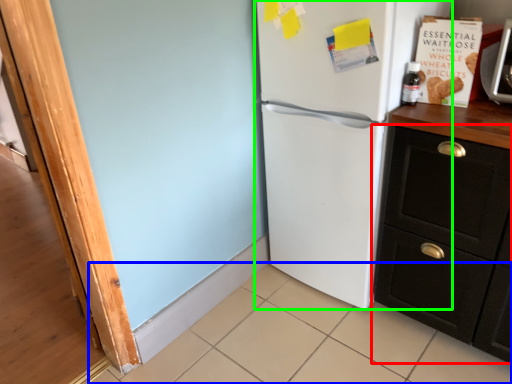
Question: Which is farther away from cabinetry (highlighted by a red box)? tile (highlighted by a blue box) or refrigerator (highlighted by a green box)?

Choices:
 (A) tile
 (B) refrigerator

Answer: (A)